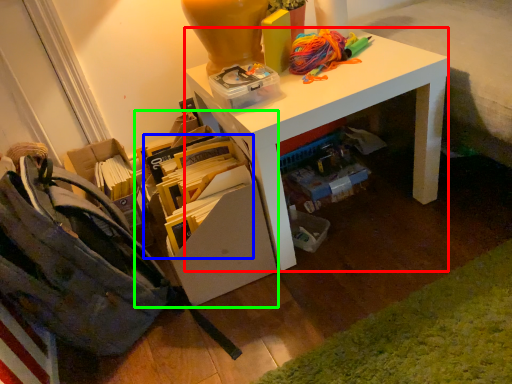
Question: Considering the real-world distances, which object is closest to desk (highlighted by a red box)? book (highlighted by a blue box) or shelf (highlighted by a green box).

Choices:
 (A) book
 (B) shelf

Answer: (B)